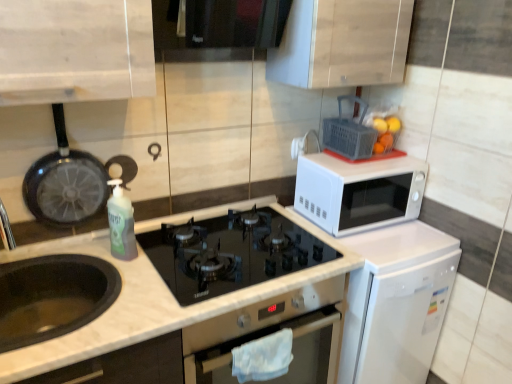
Identify the location of free space in front of translucent plastic bottle at center-left. Image resolution: width=512 pixels, height=384 pixels. (126, 282).